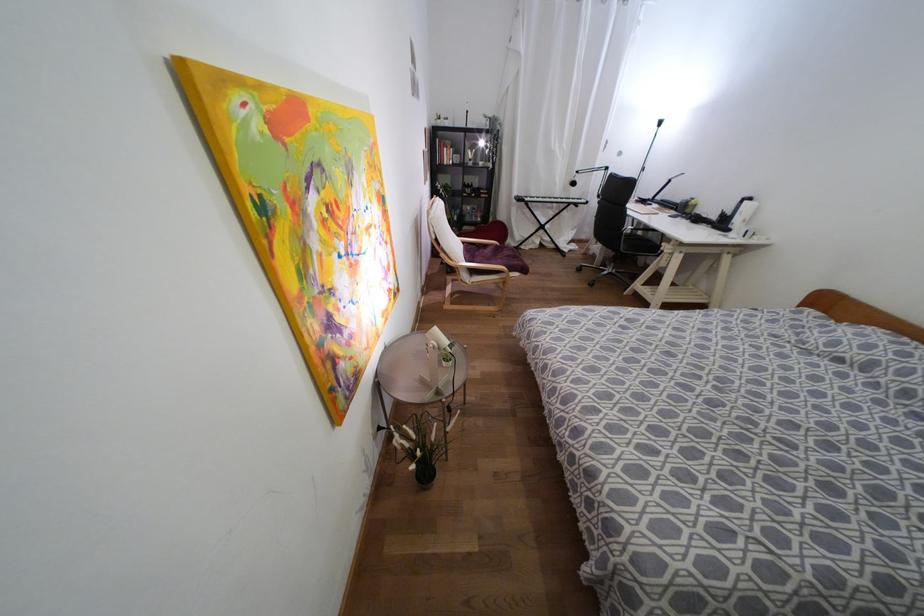
Locate an element on the screen. Image resolution: width=924 pixels, height=616 pixels. chair sitting surface is located at coordinates (495, 256).